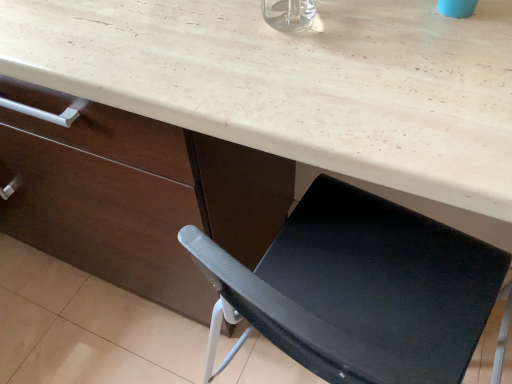
The width and height of the screenshot is (512, 384). Describe the element at coordinates (297, 83) in the screenshot. I see `matte wood countertop at center` at that location.

You are a GUI agent. You are given a task and a screenshot of the screen. Output one action in this format:
    pyautogui.click(x=<x>, y=<y>)
    Task: Click on the matte wood countertop at center
    This screenshot has height=384, width=512.
    Given the screenshot: What is the action you would take?
    pyautogui.click(x=297, y=83)

Measure the distance between matte wood countertop at center and camera.

The depth of matte wood countertop at center is 16.10 inches.

You are a GUI agent. You are given a task and a screenshot of the screen. Output one action in this format:
    pyautogui.click(x=<x>, y=<y>)
    Task: Click on the matte wood countertop at center
    The width and height of the screenshot is (512, 384).
    Given the screenshot: What is the action you would take?
    pyautogui.click(x=297, y=83)